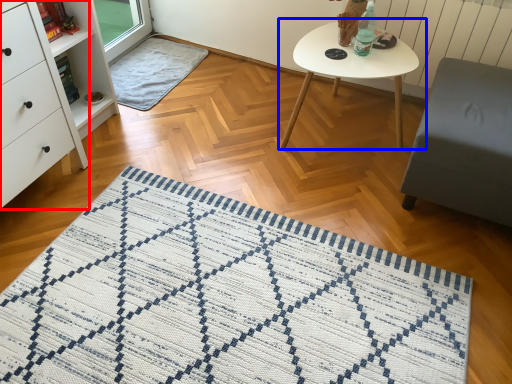
Question: Among these objects, which one is nearest to the camera, chest of drawers (highlighted by a red box) or coffee table (highlighted by a blue box)?

Choices:
 (A) chest of drawers
 (B) coffee table

Answer: (A)